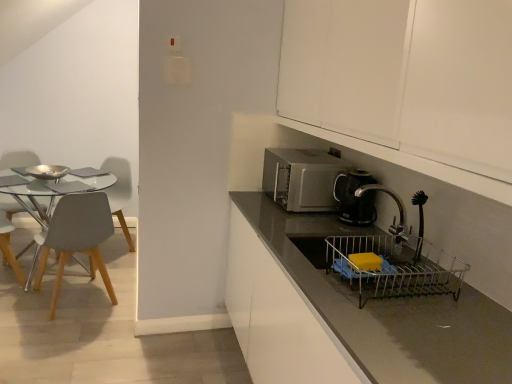
Question: Looking at their shapes, would you say light gray plastic chair at left, the 4th chair from the left, is wider or thinner than matte gray countertop at center?

Choices:
 (A) thin
 (B) wide

Answer: (A)

Question: From a real-world perspective, is light gray plastic chair at left, the 4th chair from the left, physically located above or below matte gray countertop at center?

Choices:
 (A) below
 (B) above

Answer: (A)

Question: Considering the real-world distances, which object is closest to the light gray plastic chair at left, the first chair positioned from the right?

Choices:
 (A) matte gray countertop at center
 (B) black plastic coffee maker at right
 (C) matte gray chair at left, the 3th chair in the left-to-right sequence
 (D) metallic silver sink at lower right
 (E) shiny silver bowl at left

Answer: (E)

Question: Estimate the real-world distances between objects in this image. Which object is farther from the metallic silver sink at lower right?

Choices:
 (A) matte gray countertop at center
 (B) satin silver microwave at center
 (C) black plastic coffee maker at right
 (D) white matte cabinet at upper right
 (E) light gray plastic chair at left, which is the third chair from right to left

Answer: (E)